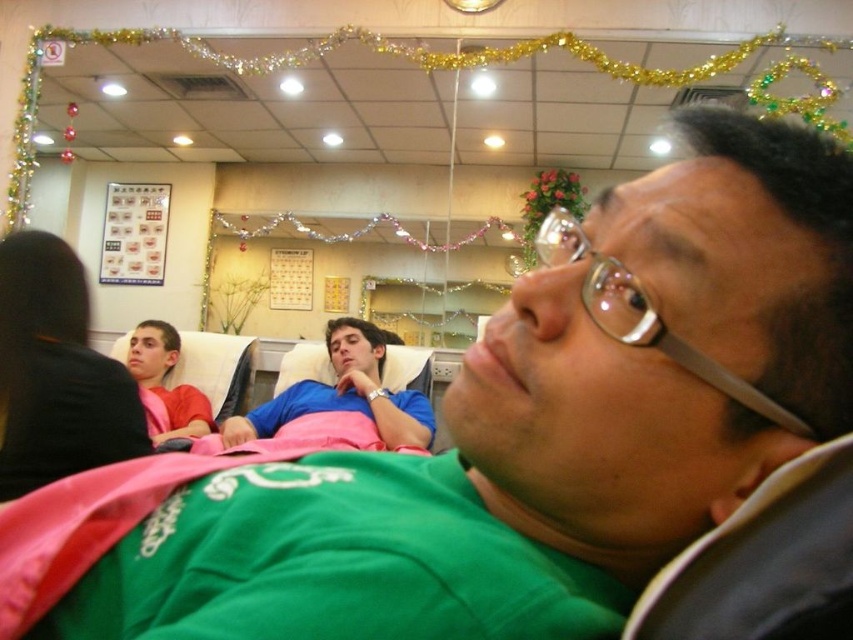
Question: From the image, what is the correct spatial relationship of pink fabric at left in relation to blue cotton shirt at center?

Choices:
 (A) left
 (B) right

Answer: (A)

Question: Which object is the farthest from the pink fabric at left?

Choices:
 (A) blue cotton shirt at center
 (B) matte pink shirt at left

Answer: (B)

Question: Which point appears farthest from the camera in this image?

Choices:
 (A) (47, 444)
 (B) (200, 394)
 (C) (364, 358)

Answer: (B)

Question: Does blue cotton shirt at center lie in front of matte pink shirt at left?

Choices:
 (A) yes
 (B) no

Answer: (A)

Question: Which point appears farthest from the camera in this image?

Choices:
 (A) (12, 323)
 (B) (374, 413)
 (C) (138, 340)

Answer: (C)

Question: Does pink fabric at left appear on the left side of blue cotton shirt at center?

Choices:
 (A) no
 (B) yes

Answer: (B)